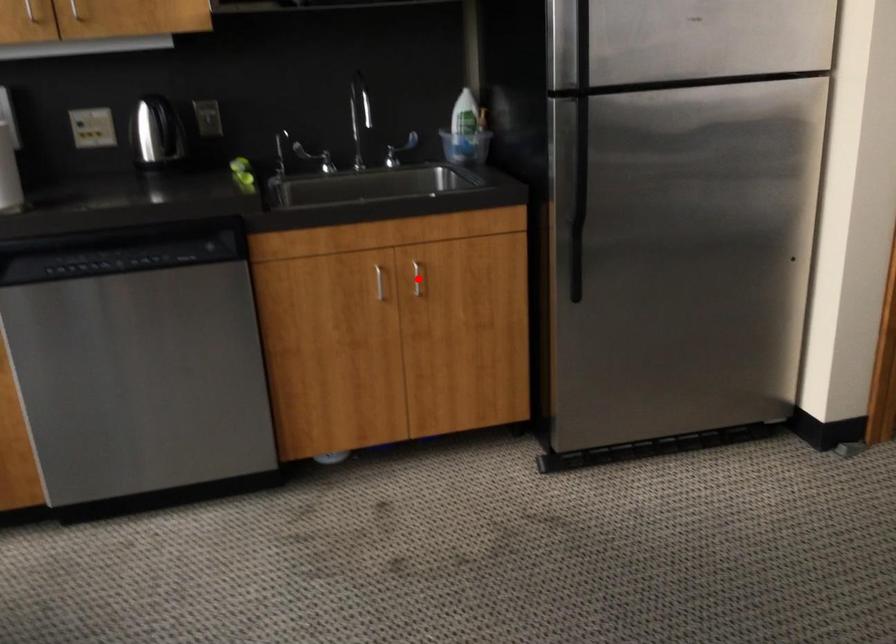
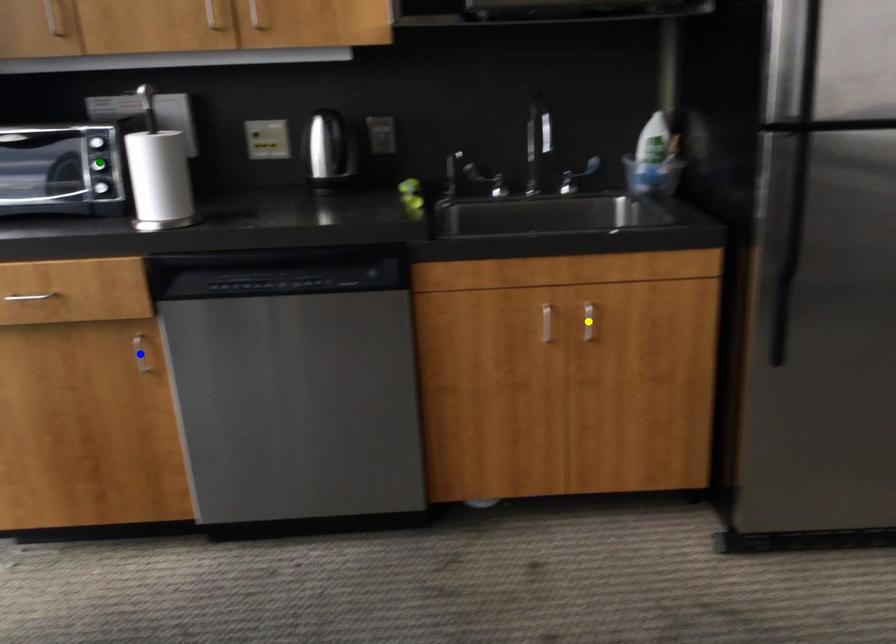
Question: I am providing you with two images of the same scene from different viewpoints. A red point is marked on the first image. You are given multiple points on the second image. Which point in image 2 is actually the same real-world point as the red point in image 1?

Choices:
 (A) yellow point
 (B) blue point
 (C) green point

Answer: (A)